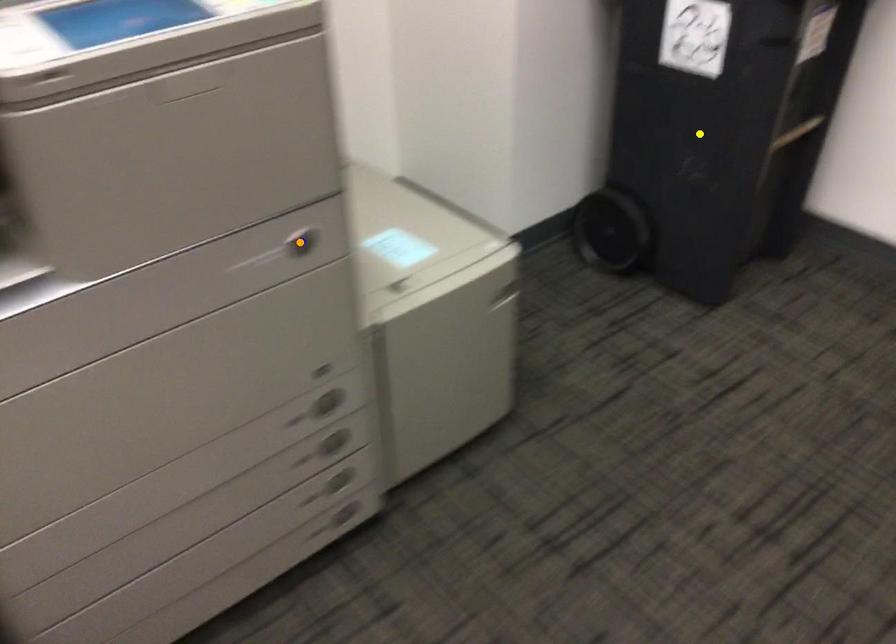
Order these from nearest to farthest:
blue point
yellow point
orange point

blue point → orange point → yellow point